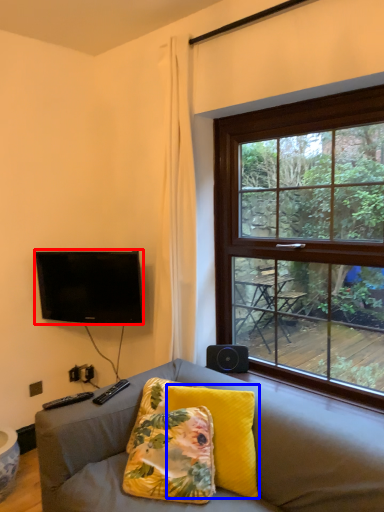
Question: Which point is closer to the camera, television (highlighted by a red box) or pillow (highlighted by a blue box)?

Choices:
 (A) television
 (B) pillow

Answer: (B)